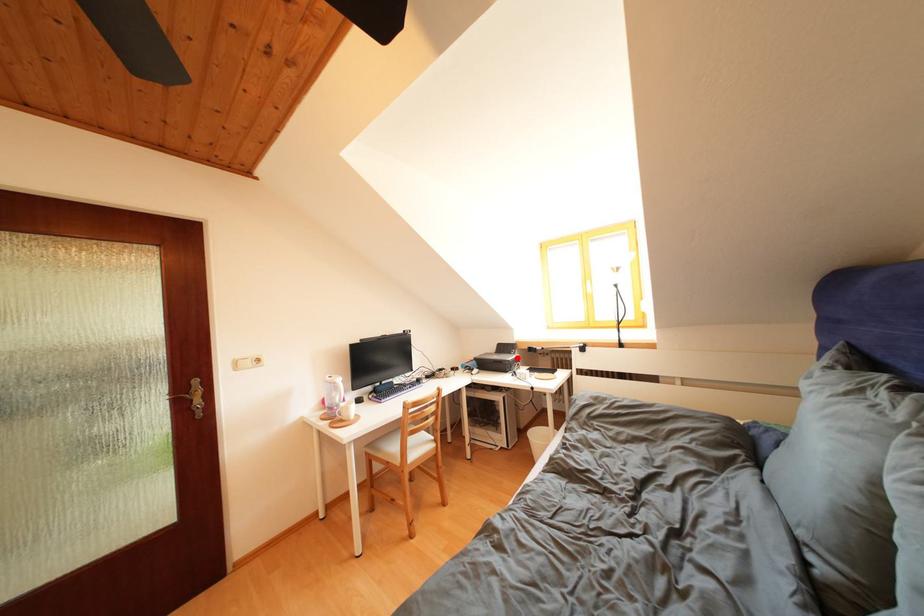
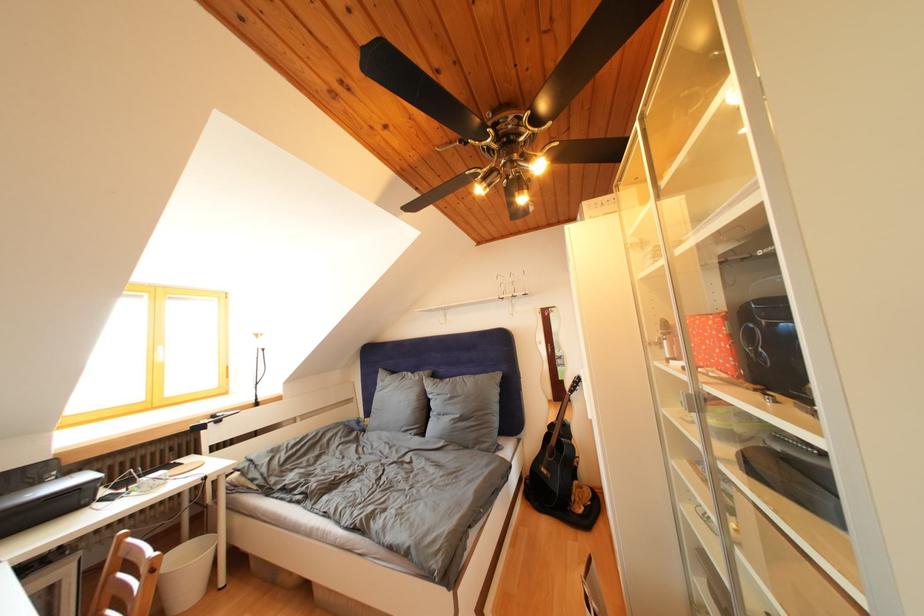
Question: I am providing you with two images of the same scene from different viewpoints. In image1, a red point is highlighted. Considering the same 3D point in image2, which of the following is correct?

Choices:
 (A) It is closer
 (B) It is farther

Answer: (A)